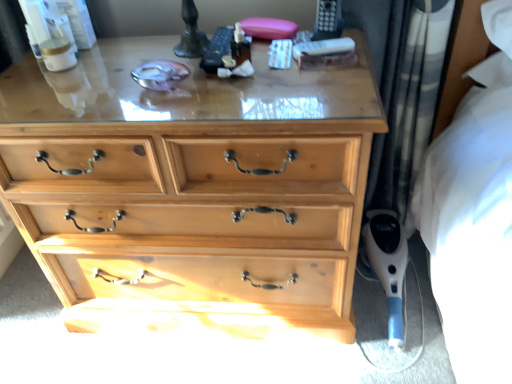
Question: From the image's perspective, relative to plaid fabric curtain at right, is natural wood chest of drawers at center above or below?

Choices:
 (A) below
 (B) above

Answer: (A)

Question: From a real-world perspective, is natural wood chest of drawers at center physically located above or below plaid fabric curtain at right?

Choices:
 (A) above
 (B) below

Answer: (B)

Question: Which of these objects is positioned closest to the natural wood chest of drawers at center?

Choices:
 (A) plaid fabric curtain at right
 (B) blue plastic vacuum cleaner at lower right

Answer: (A)

Question: Based on their relative distances, which object is farther from the blue plastic vacuum cleaner at lower right?

Choices:
 (A) natural wood chest of drawers at center
 (B) plaid fabric curtain at right

Answer: (A)